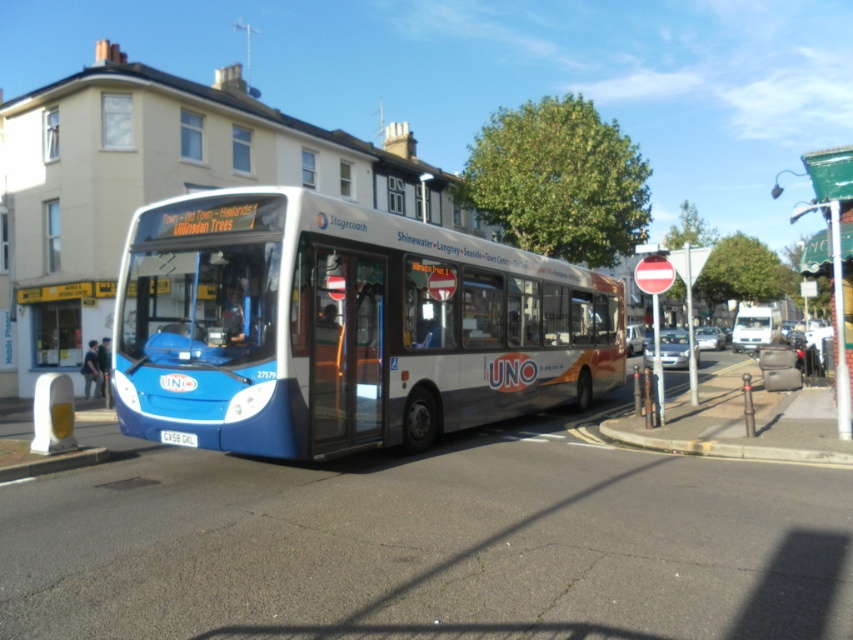
Question: Which object is closer to the camera taking this photo?

Choices:
 (A) blue metallic bus at center
 (B) white glossy van at right
 (C) gray concrete curb at lower right

Answer: (A)

Question: Does blue metallic bus at center have a smaller size compared to white glossy van at right?

Choices:
 (A) no
 (B) yes

Answer: (B)

Question: Among these objects, which one is farthest from the camera?

Choices:
 (A) gray concrete curb at lower right
 (B) white glossy van at right

Answer: (B)

Question: Can you confirm if blue metallic bus at center is bigger than white glossy van at right?

Choices:
 (A) no
 (B) yes

Answer: (A)

Question: Based on their relative distances, which object is nearer to the blue metallic bus at center?

Choices:
 (A) white glossy van at right
 (B) gray concrete curb at lower right

Answer: (B)

Question: Is blue metallic bus at center further to the viewer compared to gray concrete curb at lower right?

Choices:
 (A) no
 (B) yes

Answer: (A)